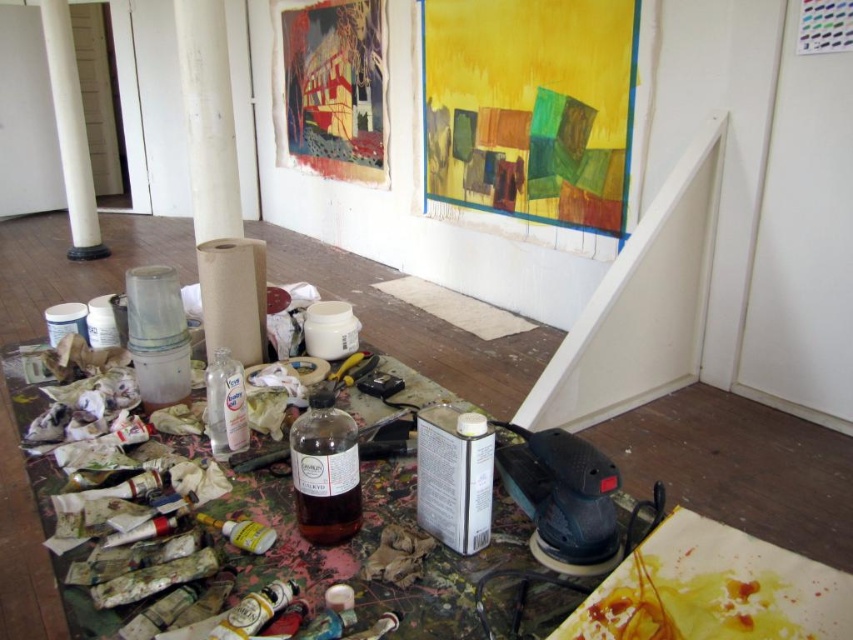
Question: Which object is the closest to the translucent glass bottle at center?

Choices:
 (A) translucent yellow bottle at center
 (B) clear plastic bottle at center
 (C) translucent plastic bottle at center
 (D) white paper at center

Answer: (A)

Question: Which point is farther to the camera?

Choices:
 (A) white glossy column at upper left
 (B) clear plastic bottle at center
 (C) translucent plastic bottle at center

Answer: (A)

Question: Estimate the real-world distances between objects in this image. Which object is closer to the translucent glass bottle at center?

Choices:
 (A) translucent plastic bottle at center
 (B) white paper at center
 (C) white glossy column at upper left

Answer: (A)

Question: Is translucent glass bottle at center thinner than matte gold paint tube at lower center?

Choices:
 (A) yes
 (B) no

Answer: (B)

Question: Considering the relative positions of translucent glass bottle at center and white glossy column at upper left in the image provided, where is translucent glass bottle at center located with respect to white glossy column at upper left?

Choices:
 (A) left
 (B) right

Answer: (B)

Question: Is white glossy column at upper left positioned in front of translucent yellow bottle at center?

Choices:
 (A) yes
 (B) no

Answer: (B)